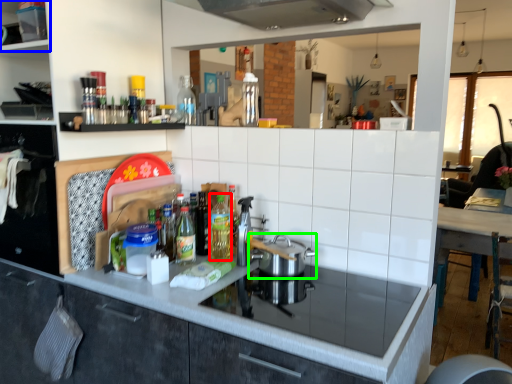
Question: Which is farther away from bottle (highlighted by a red box)? shelf (highlighted by a blue box) or kitchen appliance (highlighted by a green box)?

Choices:
 (A) shelf
 (B) kitchen appliance

Answer: (A)